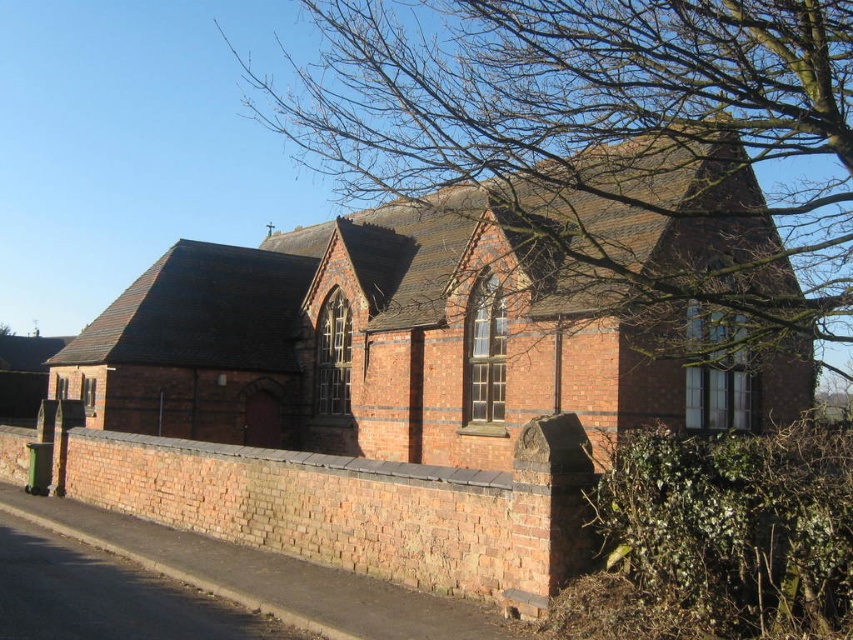
You are standing in front of the red brick church at center and looking up. Do you see the bare branches at upper center above the church?

Yes, the red brick church at center is below bare branches at upper center, so when looking up, you will see the bare branches at upper center above the church.